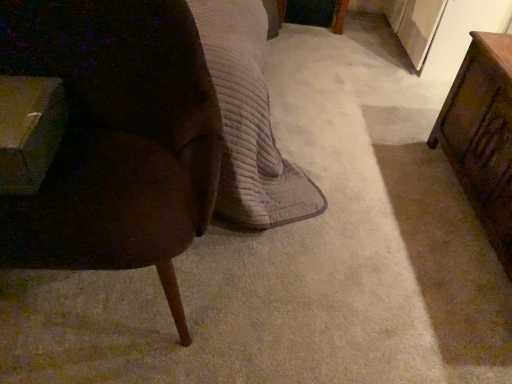
Question: Is wooden table at left, arranged as the 1th table when viewed from the left, positioned in front of wooden table at right, the second table viewed from the left?

Choices:
 (A) yes
 (B) no

Answer: (A)

Question: Is wooden table at left, arranged as the second table when viewed from the right, completely or partially outside of wooden table at right, the second table viewed from the left?

Choices:
 (A) no
 (B) yes

Answer: (B)

Question: Is wooden table at left, arranged as the 1th table when viewed from the left, facing away from wooden table at right, the second table viewed from the left?

Choices:
 (A) yes
 (B) no

Answer: (B)

Question: Is wooden table at left, arranged as the 1th table when viewed from the left, placed right next to wooden table at right, which is the first table in right-to-left order?

Choices:
 (A) yes
 (B) no

Answer: (B)

Question: Considering the relative sizes of wooden table at left, arranged as the 1th table when viewed from the left, and wooden table at right, which is the first table in right-to-left order, in the image provided, is wooden table at left, arranged as the 1th table when viewed from the left, wider than wooden table at right, which is the first table in right-to-left order,?

Choices:
 (A) yes
 (B) no

Answer: (B)

Question: Is point (39, 157) closer or farther from the camera than point (487, 135)?

Choices:
 (A) closer
 (B) farther

Answer: (A)

Question: Is wooden table at left, arranged as the 1th table when viewed from the left, taller or shorter than wooden table at right, the second table viewed from the left?

Choices:
 (A) short
 (B) tall

Answer: (A)

Question: Is wooden table at left, arranged as the second table when viewed from the right, to the left or to the right of wooden table at right, which is the first table in right-to-left order, in the image?

Choices:
 (A) right
 (B) left

Answer: (B)

Question: From a real-world perspective, is wooden table at left, arranged as the 1th table when viewed from the left, positioned above or below wooden table at right, which is the first table in right-to-left order?

Choices:
 (A) above
 (B) below

Answer: (A)

Question: Is wooden table at right, the second table viewed from the left, spatially inside wooden table at left, arranged as the second table when viewed from the right, or outside of it?

Choices:
 (A) inside
 (B) outside

Answer: (B)

Question: Is wooden table at right, which is the first table in right-to-left order, to the left or to the right of wooden table at left, arranged as the 1th table when viewed from the left, in the image?

Choices:
 (A) left
 (B) right

Answer: (B)

Question: Considering the positions of wooden table at right, the second table viewed from the left, and wooden table at left, arranged as the 1th table when viewed from the left, in the image, is wooden table at right, the second table viewed from the left, bigger or smaller than wooden table at left, arranged as the 1th table when viewed from the left,?

Choices:
 (A) small
 (B) big

Answer: (B)

Question: Is point (474, 71) positioned closer to the camera than point (23, 192)?

Choices:
 (A) closer
 (B) farther

Answer: (B)

Question: From their relative heights in the image, would you say velvet brown chair at left is taller or shorter than wooden table at right, the second table viewed from the left?

Choices:
 (A) short
 (B) tall

Answer: (B)

Question: From a real-world perspective, relative to wooden table at right, the second table viewed from the left, is velvet brown chair at left vertically above or below?

Choices:
 (A) above
 (B) below

Answer: (A)